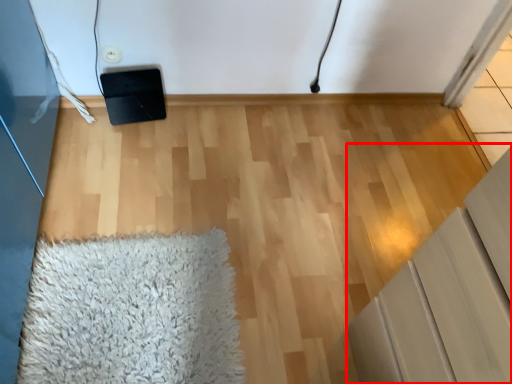
Question: Observing the image, what is the correct spatial positioning of furniture (annotated by the red box) in reference to mat?

Choices:
 (A) left
 (B) right

Answer: (B)